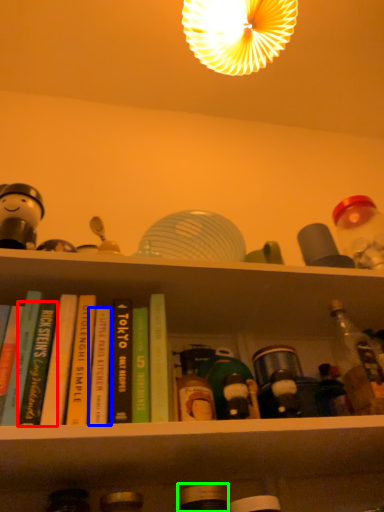
Question: Based on their relative distances, which object is nearer to book (highlighted by a red box)? Choose from book (highlighted by a blue box) and bottle (highlighted by a green box).

Choices:
 (A) book
 (B) bottle

Answer: (A)